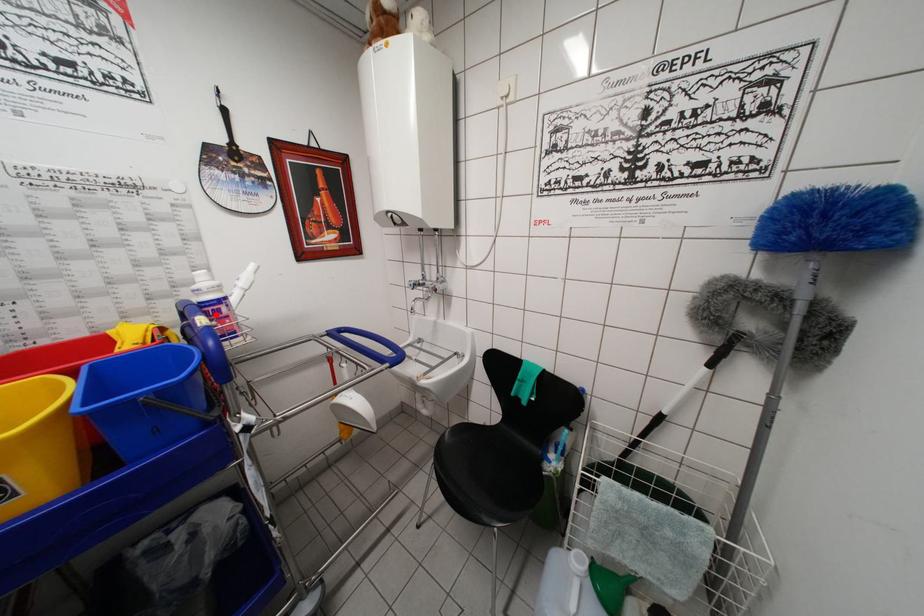
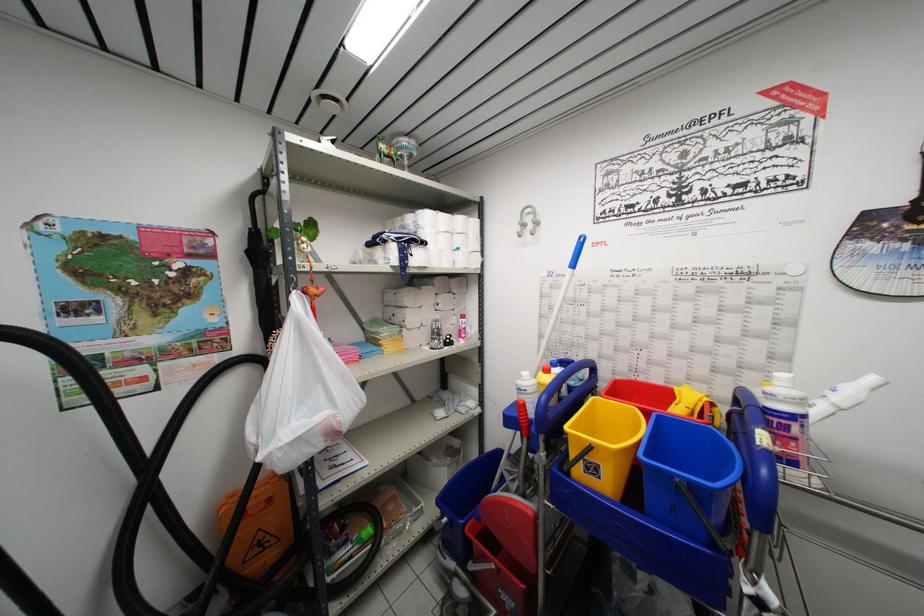
In the second image, find the point that corresponds to the highlighted location in the first image.

(783, 428)